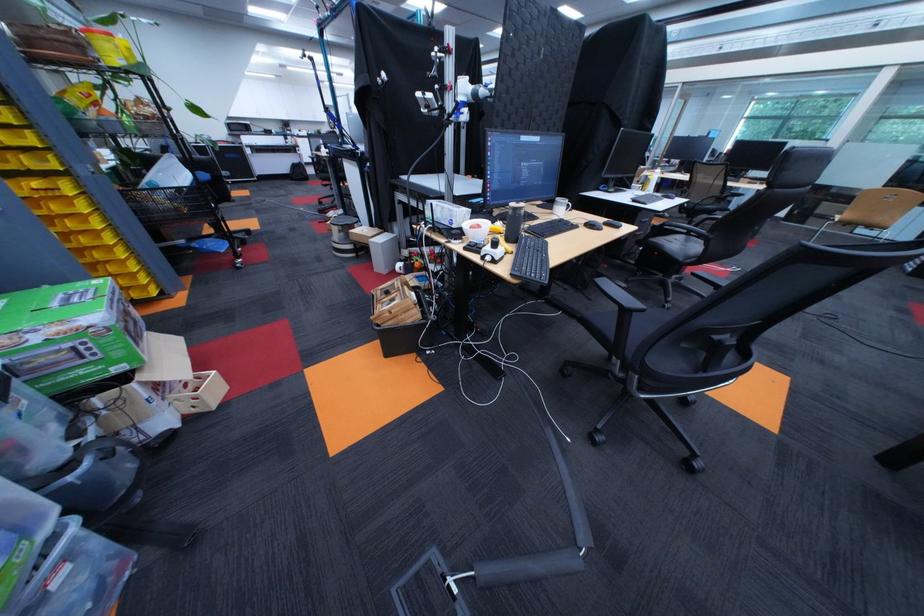
Where is `white ceramic mug`? This screenshot has width=924, height=616. white ceramic mug is located at coordinates (561, 206).